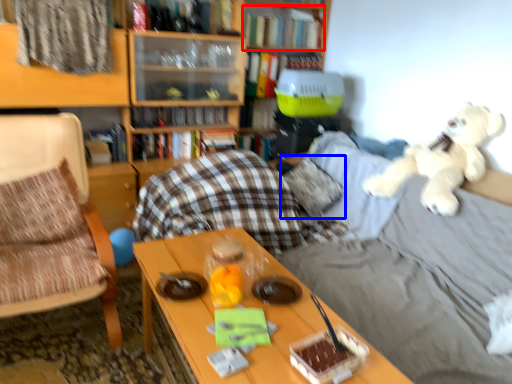
Question: Which of the following is the farthest to the observer, book (highlighted by a red box) or pillow (highlighted by a blue box)?

Choices:
 (A) book
 (B) pillow

Answer: (A)